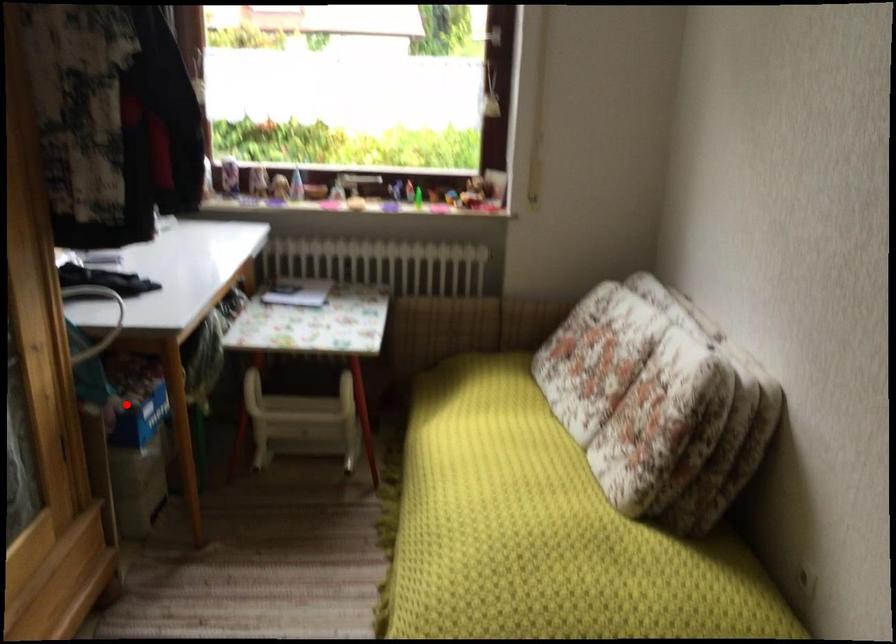
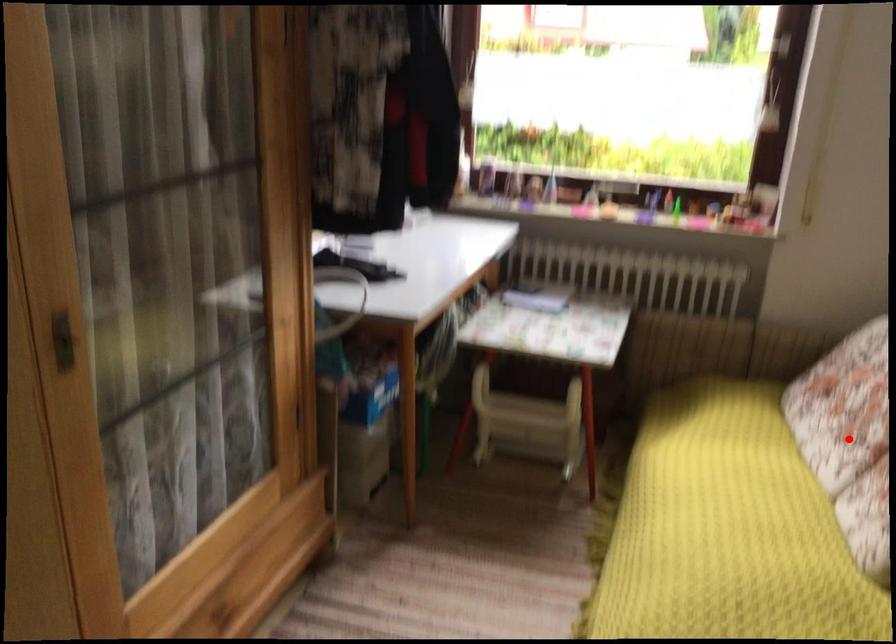
I am providing you with two images of the same scene from different viewpoints. A red point is marked on the first image and another point is marked on the second image. Is the marked point in image1 the same physical position as the marked point in image2?

No